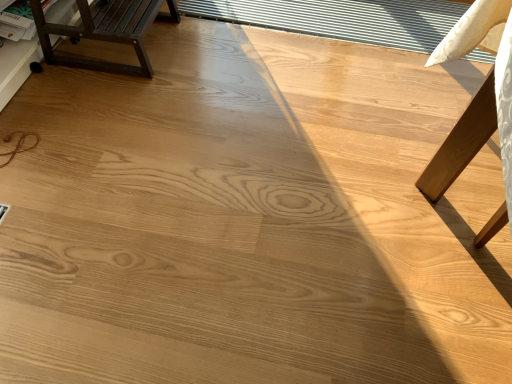
Locate an element on the screen. The image size is (512, 384). free area in between matte dark brown wooden bench at upper left and transparent plastic window at upper center is located at coordinates (271, 56).